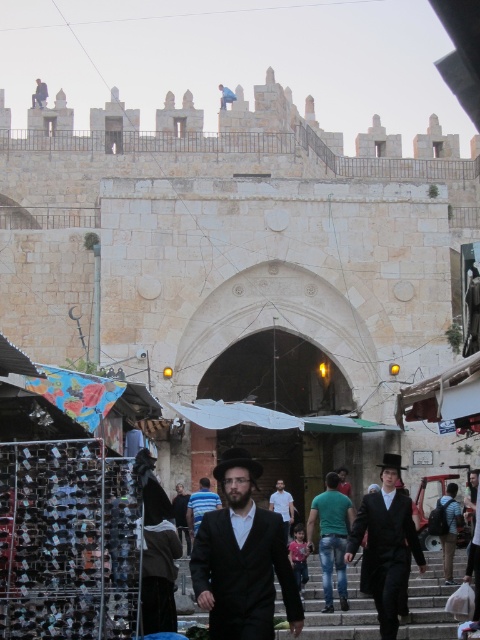
In the scene shown: You are standing at the entrance of the city and see two people wearing a black wool suit at center and a green cotton shirt at center. You want to greet both individuals. Which one should you approach first if you want to minimize the total distance walked?

You should approach the black wool suit at center first because it is closer to you than the green cotton shirt at center, as the distance between them is 15.28 meters. However, since both are at the center, you might need to check their exact positions for the shortest path.

You are a tailor observing two suits at a market stall in the historical entrance scene. The black wool suit at center and the black matte suit at center are both displayed. Which suit is shorter in height?

The black wool suit at center is shorter in height compared to the black matte suit at center.